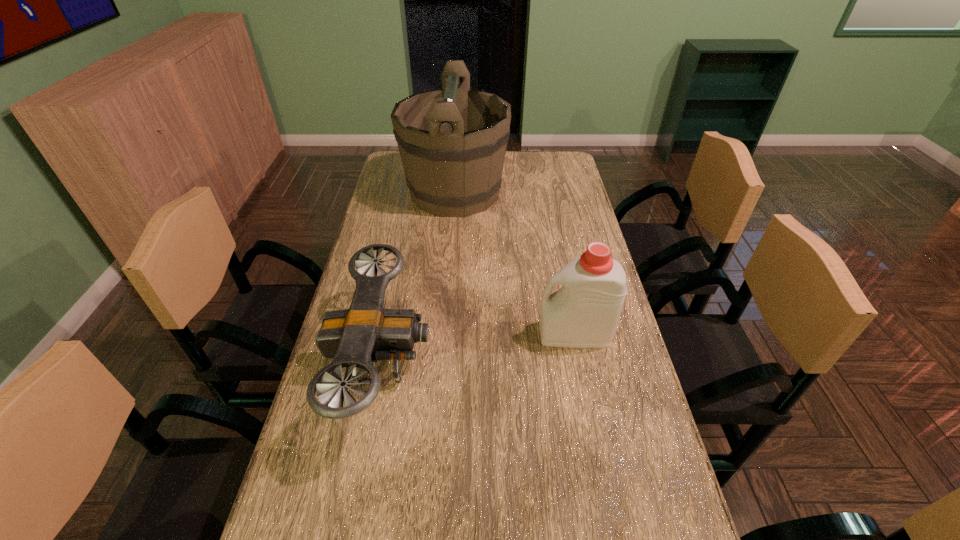
The image size is (960, 540). I want to click on object positioned at the far edge, so [452, 141].

Identify the location of bucket at the left edge. (452, 141).

You are a GUI agent. You are given a task and a screenshot of the screen. Output one action in this format:
    pyautogui.click(x=<x>, y=<y>)
    Task: Click on the drone positioned at the left edge
    
    Given the screenshot: What is the action you would take?
    pyautogui.click(x=357, y=337)

Find the location of a particular element. The width and height of the screenshot is (960, 540). object that is positioned at the right edge is located at coordinates coord(584,312).

Find the location of `object present at the far left corner`. object present at the far left corner is located at coordinates pyautogui.click(x=452, y=141).

You are a GUI agent. You are given a task and a screenshot of the screen. Output one action in this format:
    pyautogui.click(x=<x>, y=<y>)
    Task: Click on the vacant region at the left edge of the desktop
    The image size is (960, 540).
    Given the screenshot: What is the action you would take?
    pyautogui.click(x=371, y=222)

Identify the location of free space at the right edge of the desktop. (611, 492).

Locate an element on the screen. The width and height of the screenshot is (960, 540). vacant area at the far right corner of the desktop is located at coordinates (553, 156).

Find the location of a particular element. The height and width of the screenshot is (540, 960). unoccupied area between the bucket and the shortest object is located at coordinates (419, 278).

Image resolution: width=960 pixels, height=540 pixels. What are the coordinates of `free space between the second tallest object and the bucket` in the screenshot? It's located at (515, 263).